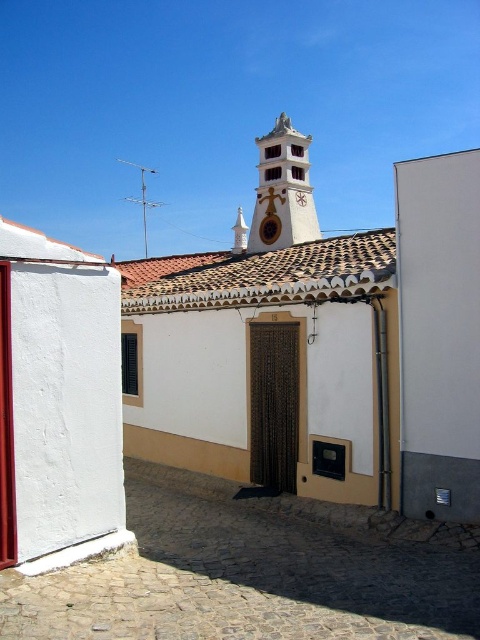
Is point (360, 445) positioned in front of point (276, 248)?

Yes, point (360, 445) is in front of point (276, 248).

Where is `white textured church at center`? white textured church at center is located at coordinates (269, 348).